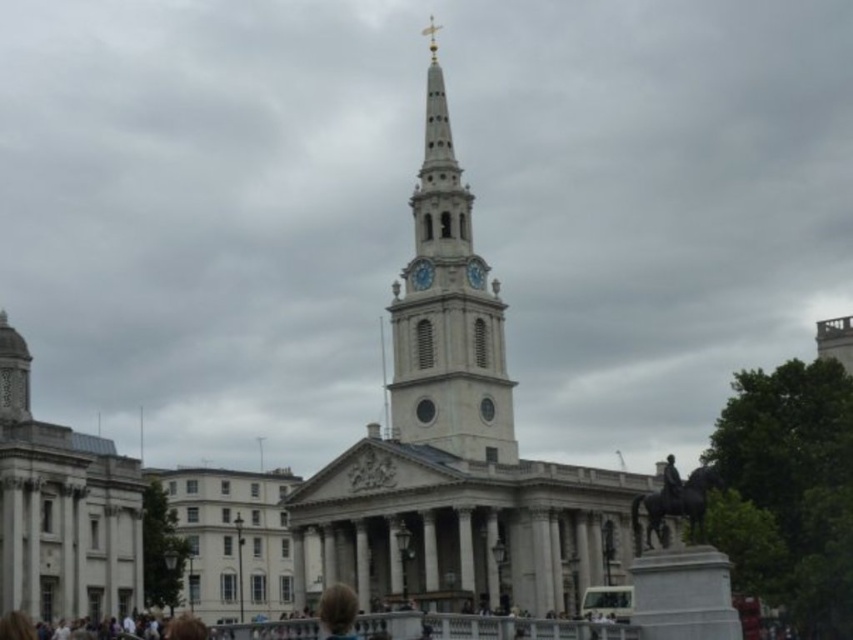
Question: Does white stone clock tower at center appear under white stone building at left?

Choices:
 (A) no
 (B) yes

Answer: (A)

Question: Is white stone church at center closer to camera compared to blue painted metal clock at center?

Choices:
 (A) yes
 (B) no

Answer: (A)

Question: Which point is closer to the camera taking this photo?

Choices:
 (A) (71, 518)
 (B) (456, 301)
 (C) (412, 259)
 (D) (421, 264)

Answer: (A)

Question: Does white stone building at left have a larger size compared to blonde hair at center?

Choices:
 (A) no
 (B) yes

Answer: (B)

Question: Among these points, which one is nearest to the camera?

Choices:
 (A) (474, 280)
 (B) (413, 227)

Answer: (A)

Question: Which is nearer to the blonde hair at center?

Choices:
 (A) white stone clock at center
 (B) white stone church at center

Answer: (B)